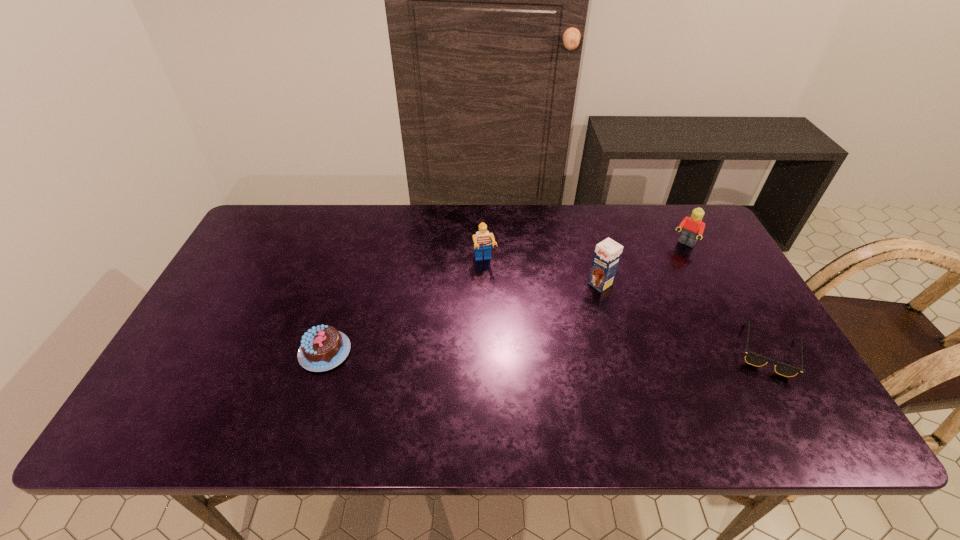
Locate an element on the screen. The image size is (960, 540). vacant space at the near right corner is located at coordinates (744, 390).

Locate an element on the screen. free space between the second shortest object and the second object from left to right is located at coordinates (405, 307).

Where is `empty location between the nearer Lego and the chocolate cake`? empty location between the nearer Lego and the chocolate cake is located at coordinates (405, 307).

The width and height of the screenshot is (960, 540). In order to click on free space that is in between the second object from left to right and the third farthest object in this screenshot , I will do `click(542, 273)`.

This screenshot has width=960, height=540. Identify the location of vacant area that lies between the farthest object and the chocolate cake. (505, 298).

Find the location of `empty location between the leftmost object and the shortest object`. empty location between the leftmost object and the shortest object is located at coordinates (546, 351).

You are a GUI agent. You are given a task and a screenshot of the screen. Output one action in this format:
    pyautogui.click(x=<x>, y=<y>)
    Task: Click on the free space that is in between the chocolate milk and the sunglasses
    
    Given the screenshot: What is the action you would take?
    pyautogui.click(x=684, y=317)

You are a GUI agent. You are given a task and a screenshot of the screen. Output one action in this format:
    pyautogui.click(x=<x>, y=<y>)
    Task: Click on the blank region between the sunglasses and the right Lego
    Image resolution: width=960 pixels, height=540 pixels.
    Given the screenshot: What is the action you would take?
    pyautogui.click(x=726, y=298)

This screenshot has width=960, height=540. I want to click on free area in between the left Lego and the sunglasses, so click(x=626, y=306).

Image resolution: width=960 pixels, height=540 pixels. What are the coordinates of `free space between the tallest object and the leftmost object` in the screenshot? It's located at coord(463,318).